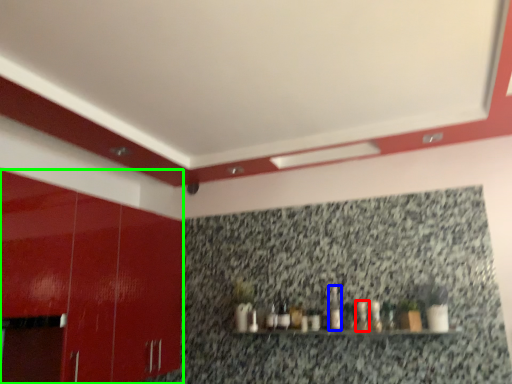
Question: Which is farther away from bottle (highlighted by a red box)? bottle (highlighted by a blue box) or cabinetry (highlighted by a green box)?

Choices:
 (A) bottle
 (B) cabinetry

Answer: (B)